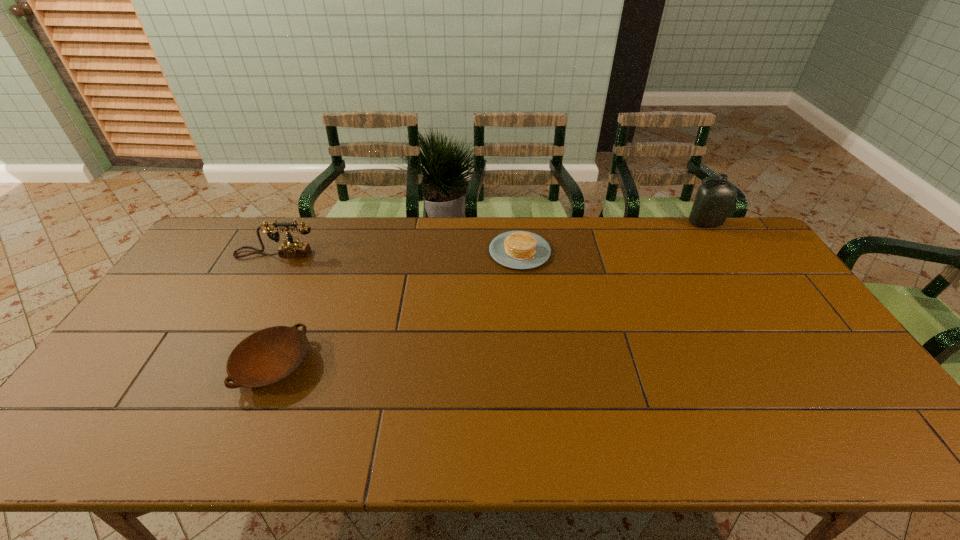
Find the location of a particular element. Image resolution: width=960 pixels, height=540 pixels. the farthest object is located at coordinates (714, 200).

Where is `the rightmost object`? The width and height of the screenshot is (960, 540). the rightmost object is located at coordinates (714, 200).

The width and height of the screenshot is (960, 540). I want to click on the third shortest object, so click(292, 248).

Find the location of `the third object from left to right`. the third object from left to right is located at coordinates (515, 249).

Identify the location of plate. The image size is (960, 540). (268, 356).

The image size is (960, 540). I want to click on free space located on the front of the bottle, so click(749, 292).

Where is `free space located 0.310m on the front-facing side of the telephone`? free space located 0.310m on the front-facing side of the telephone is located at coordinates (234, 331).

This screenshot has width=960, height=540. Identify the location of free location located 0.100m on the front of the third object from left to right. (524, 293).

At what (x,y) coordinates should I click in order to perform the action: click on vacant space situated 0.160m on the back of the plate. Please return your answer as a coordinate pair (x, y). Image resolution: width=960 pixels, height=540 pixels. Looking at the image, I should click on (303, 294).

At what (x,y) coordinates should I click in order to perform the action: click on bottle located in the far edge section of the desktop. Please return your answer as a coordinate pair (x, y). Looking at the image, I should click on (714, 200).